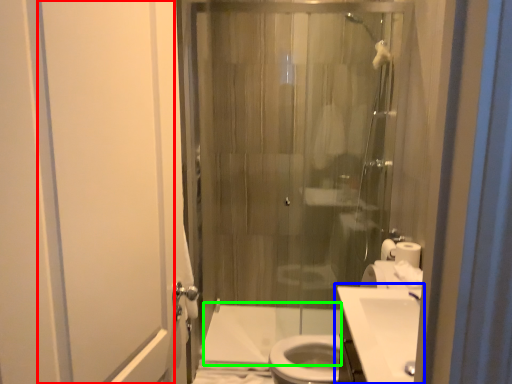
Question: Which is farther away from screen door (highlighted by a red box)? sink (highlighted by a blue box) or bath (highlighted by a green box)?

Choices:
 (A) sink
 (B) bath

Answer: (B)